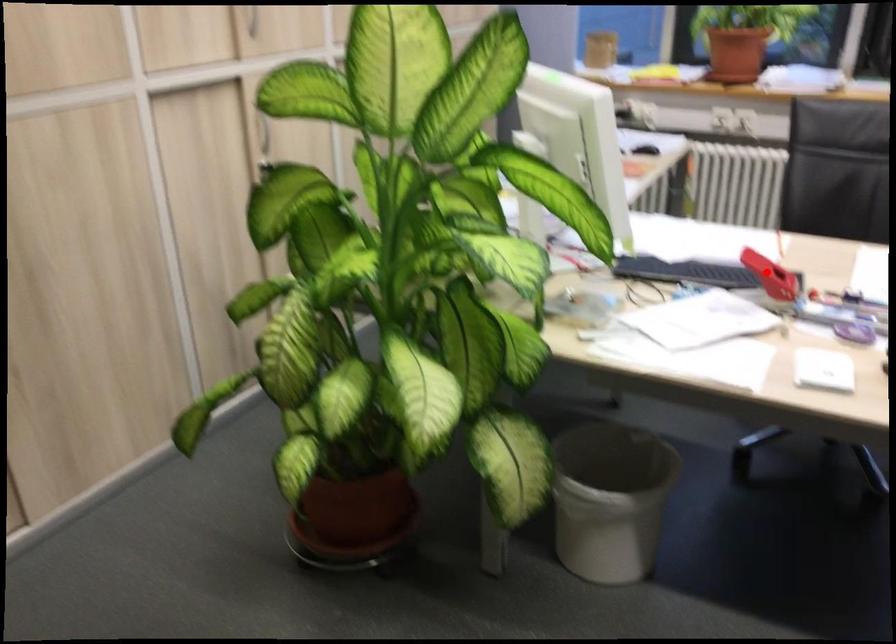
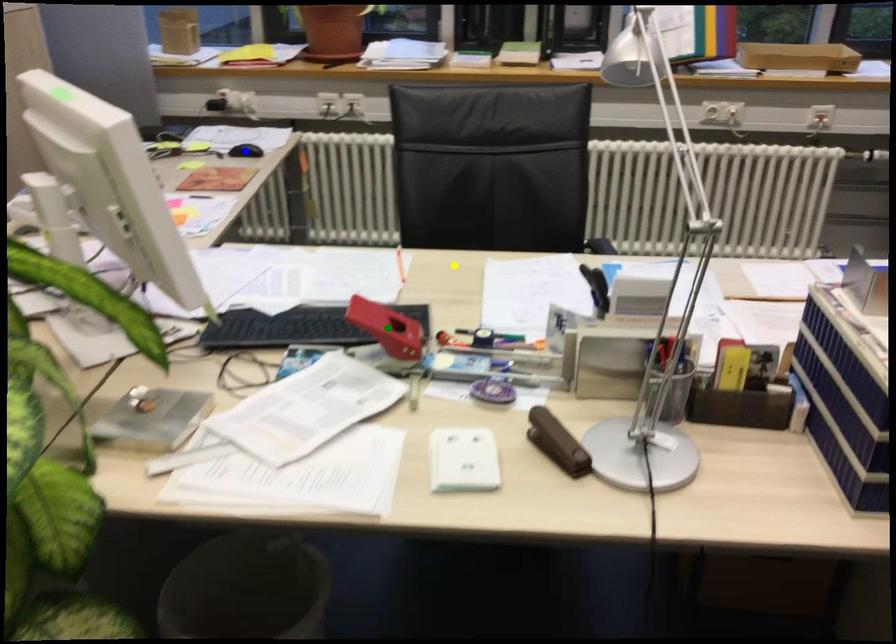
Question: I am providing you with two images of the same scene from different viewpoints. A red point is marked on the first image. You are given multiple points on the second image. In image 2, which mark is for the same physical point as the one in image 1?

Choices:
 (A) blue point
 (B) green point
 (C) yellow point

Answer: (B)